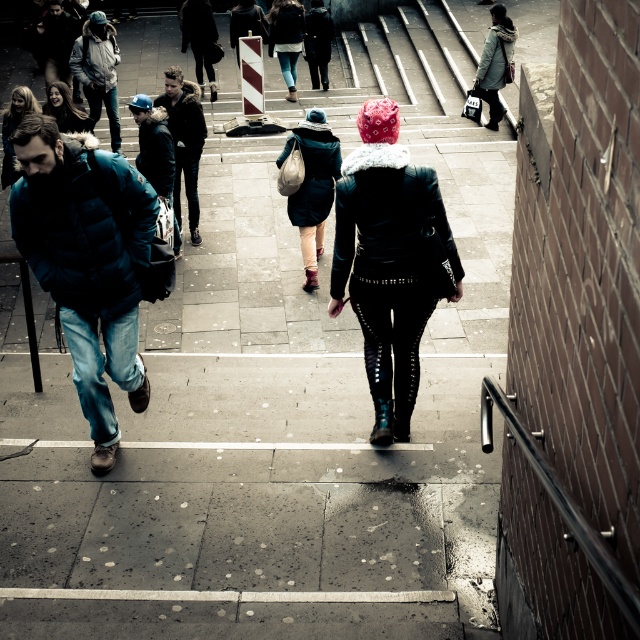
Can you confirm if matte black coat at center is positioned above dark brown hair at center?

No, matte black coat at center is not above dark brown hair at center.

What are the coordinates of `matte black coat at center` in the screenshot? It's located at (312, 186).

Is point (326, 182) positioned in front of point (154, 118)?

No, it is not.

Identify the location of matte black coat at center. This screenshot has height=640, width=640. (312, 186).

Can you confirm if denim jacket at center is smaller than dark brown hair at center?

Actually, denim jacket at center might be larger than dark brown hair at center.

Is denim jacket at center thinner than dark brown hair at center?

No.

Which is behind, point (296, 68) or point (152, 106)?

The point (296, 68) is behind.

What are the coordinates of `denim jacket at center` in the screenshot? It's located at (285, 38).

Is the position of matte black jacket at upper right more distant than that of matte black jacket at upper left?

Yes, it is behind matte black jacket at upper left.

Between matte black jacket at upper right and matte black jacket at upper left, which one is positioned lower?

Positioned lower is matte black jacket at upper left.

Describe the element at coordinates (496, 61) in the screenshot. I see `matte black jacket at upper right` at that location.

Image resolution: width=640 pixels, height=640 pixels. I want to click on matte black jacket at upper right, so click(496, 61).